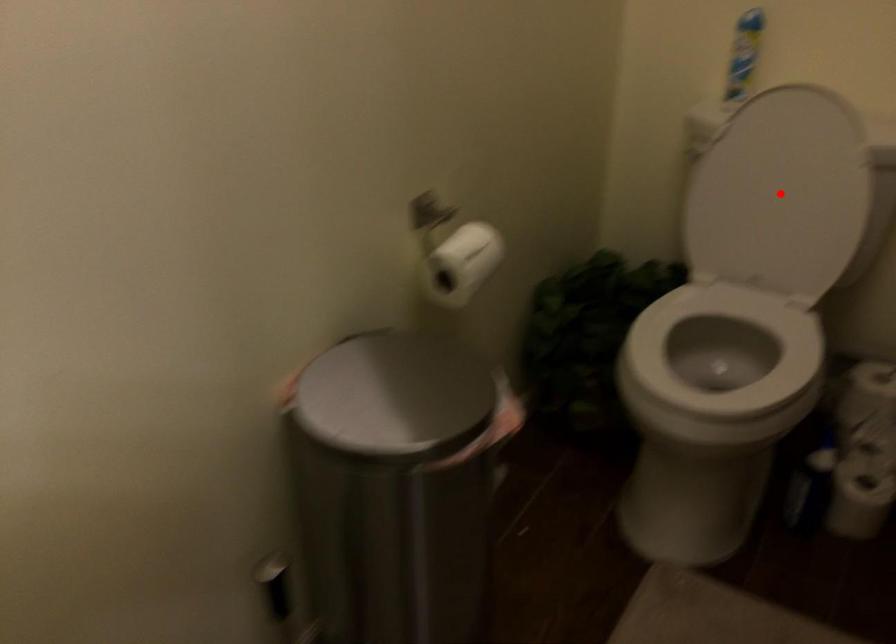
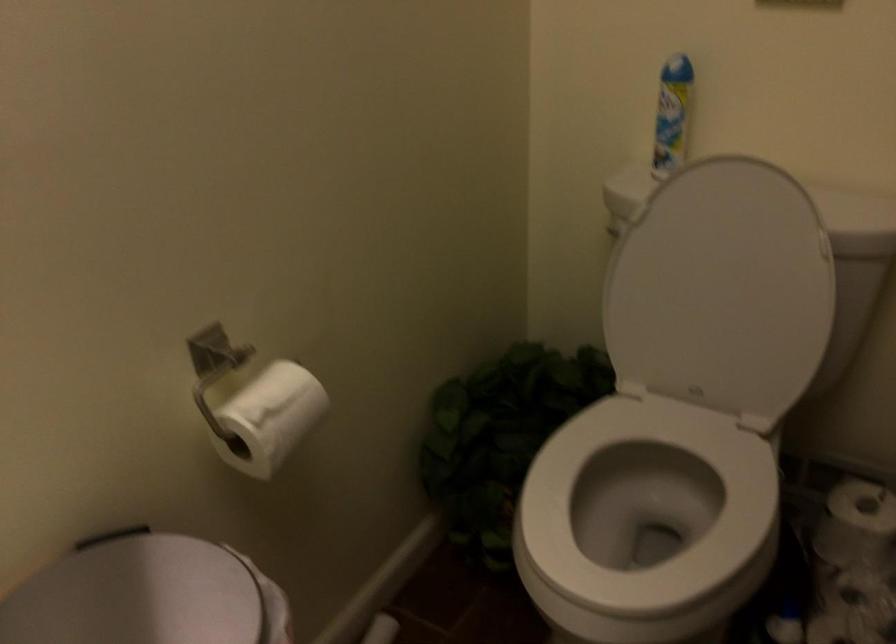
Locate, in the second image, the point that corresponds to the highlighted location in the first image.

(721, 289)